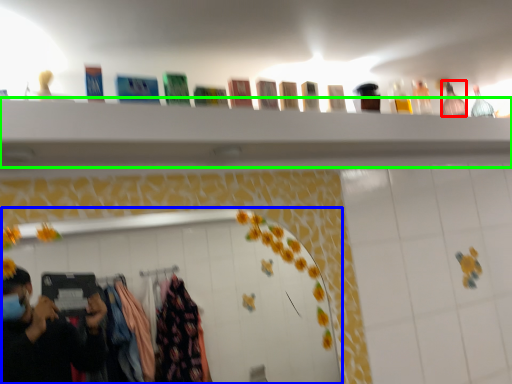
Question: Which object is the closest to the bottle (highlighted by a red box)? Choose among these: mirror (highlighted by a blue box) or closet (highlighted by a green box).

Choices:
 (A) mirror
 (B) closet

Answer: (B)